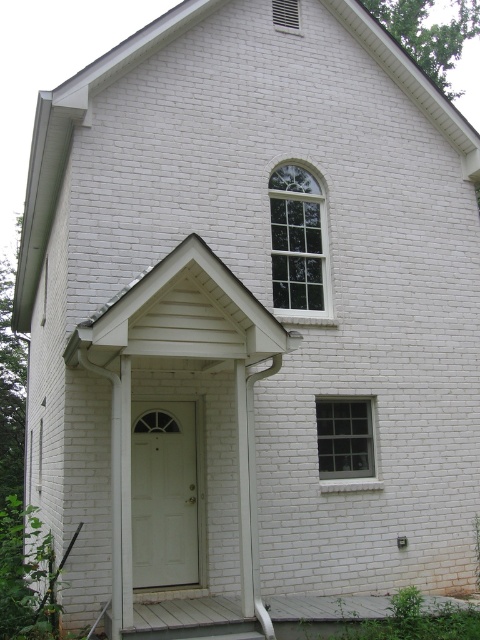
Question: Which object is farther from the camera taking this photo?

Choices:
 (A) white wooden porch at lower center
 (B) white glossy door at center
 (C) clear glass window at upper center
 (D) clear glass window at center right

Answer: (C)

Question: Does clear glass window at upper center have a larger size compared to clear glass window at center right?

Choices:
 (A) no
 (B) yes

Answer: (B)

Question: Can you confirm if white wooden porch at lower center is bigger than clear glass window at upper center?

Choices:
 (A) no
 (B) yes

Answer: (A)

Question: Is white wooden porch at lower center closer to camera compared to clear glass window at center right?

Choices:
 (A) yes
 (B) no

Answer: (A)

Question: Among these objects, which one is farthest from the camera?

Choices:
 (A) clear glass window at upper center
 (B) white glossy door at center
 (C) clear glass window at center right

Answer: (A)

Question: Which of the following is the closest to the observer?

Choices:
 (A) (134, 426)
 (B) (311, 189)

Answer: (A)